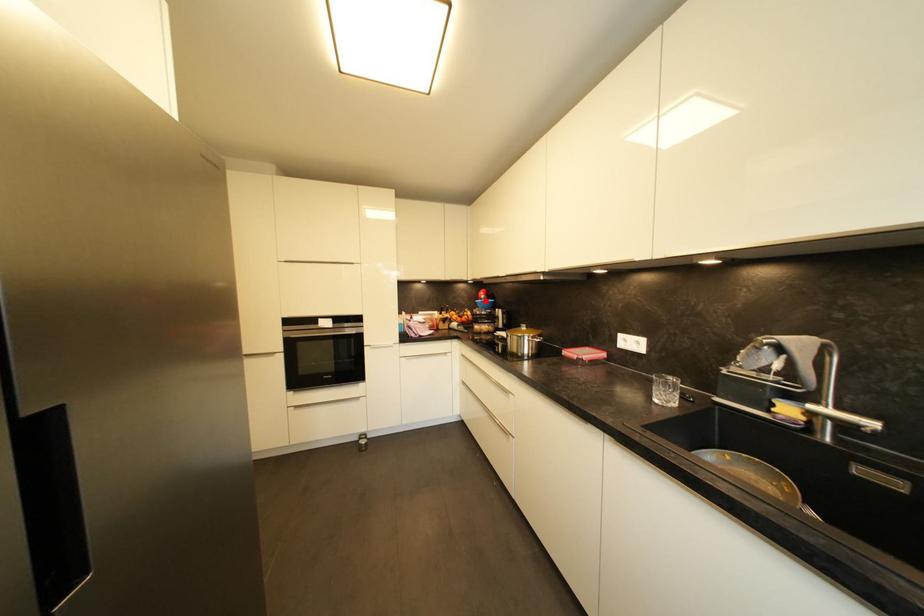
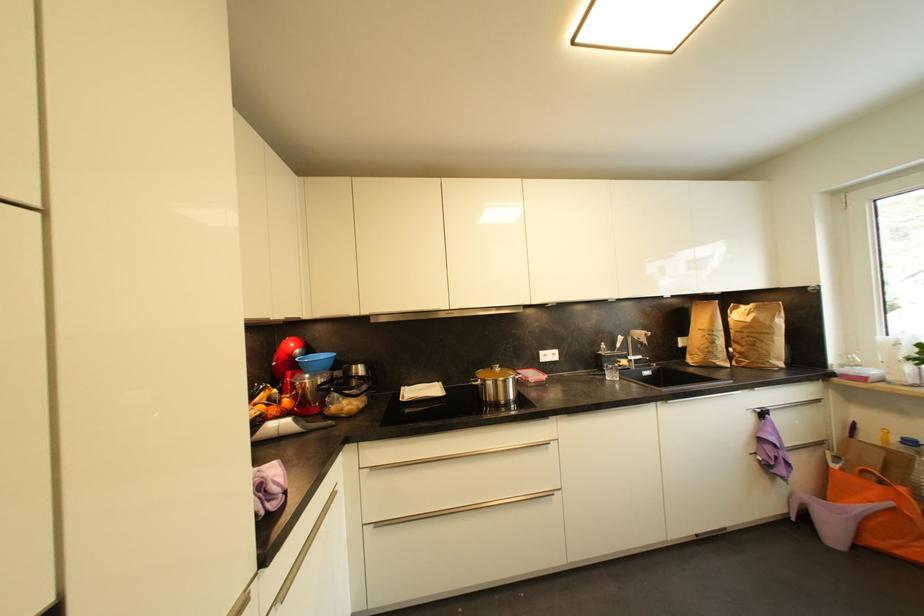
Find the pixel in the second image that matches the highlighted location in the first image.

(297, 359)